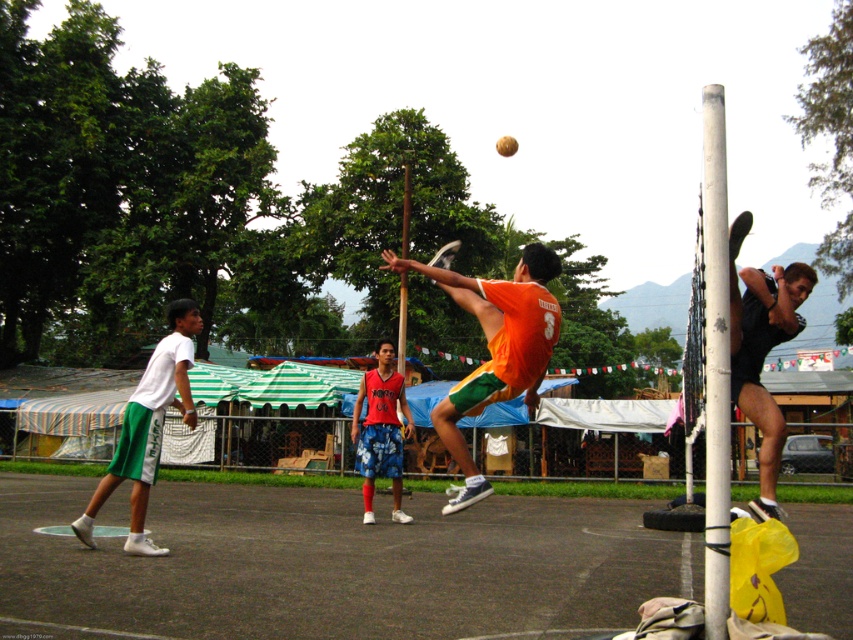
Question: Is smooth asphalt court at center positioned behind red fabric shorts at center?

Choices:
 (A) yes
 (B) no

Answer: (B)

Question: Which of the following is the farthest from the observer?

Choices:
 (A) orange jersey at center
 (B) white plastic pole at upper center

Answer: (B)

Question: Can you confirm if white painted wood pole at right is thinner than white matte shorts at left?

Choices:
 (A) yes
 (B) no

Answer: (B)

Question: Which point is farther to the camera?

Choices:
 (A) (408, 172)
 (B) (517, 385)

Answer: (A)

Question: Is red fabric shorts at center to the left of white plastic pole at upper center from the viewer's perspective?

Choices:
 (A) no
 (B) yes

Answer: (B)

Question: Among these points, which one is farthest from the camera?

Choices:
 (A) (392, 365)
 (B) (3, 493)

Answer: (A)